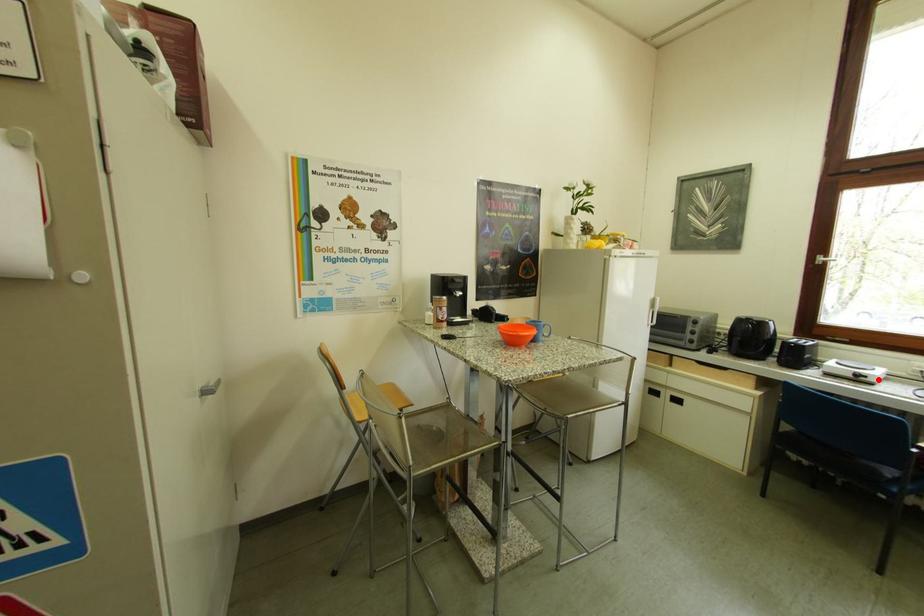
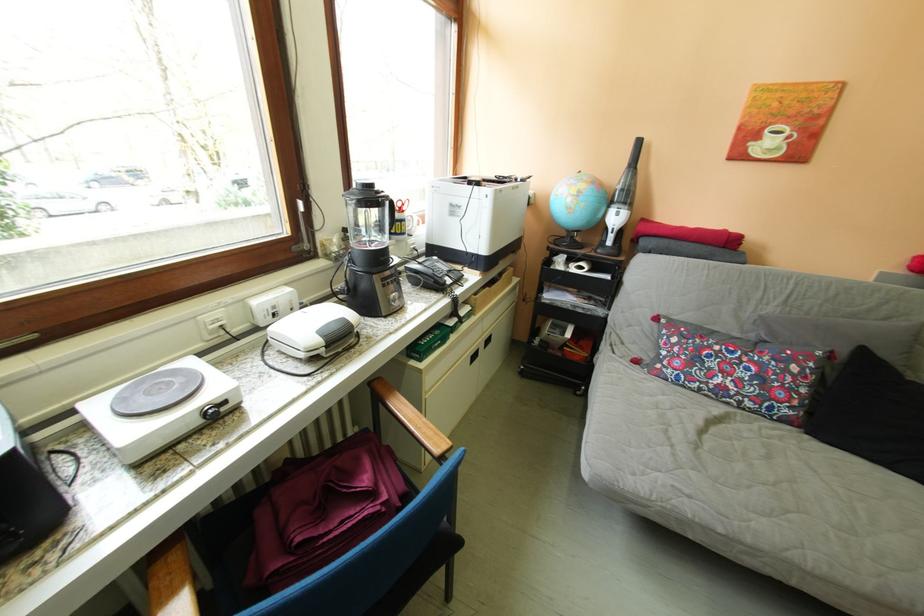
Question: I am providing you with two images of the same scene from different viewpoints. Image1 has a red point marked. In image2, the corresponding 3D location appears at what relative position? Reply with the corresponding letter.

Choices:
 (A) Closer
 (B) Farther

Answer: (A)